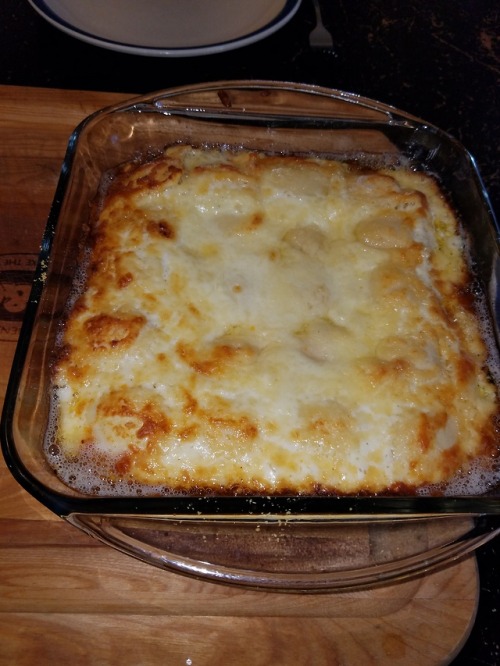
What are the coordinates of `handle` in the screenshot? It's located at (257, 577).